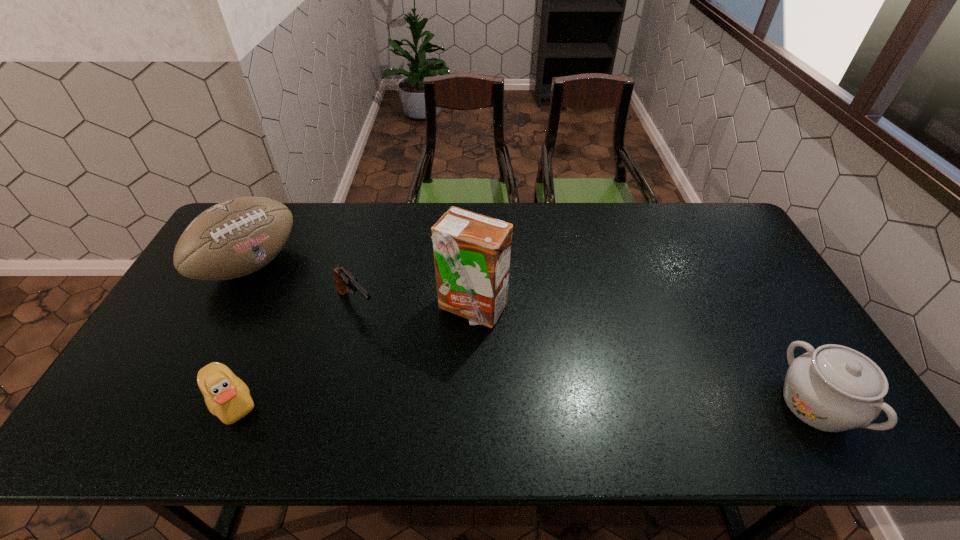
This screenshot has width=960, height=540. I want to click on vacant region located 0.240m along the barrel of the third object from right to left, so click(x=420, y=376).

In order to click on blank space located on the straw side of the tallest object in this screenshot , I will do `click(505, 399)`.

The image size is (960, 540). Find the location of `vacant space situated 0.060m on the straw side of the tallest object`. vacant space situated 0.060m on the straw side of the tallest object is located at coordinates (488, 347).

This screenshot has width=960, height=540. I want to click on free space located on the straw side of the tallest object, so click(x=491, y=356).

What are the coordinates of `vacant area situated 0.190m on the laces of the fourth shortest object` in the screenshot? It's located at (316, 314).

Where is `vacant space located 0.170m on the laces of the fourth shortest object`? The height and width of the screenshot is (540, 960). vacant space located 0.170m on the laces of the fourth shortest object is located at coordinates (311, 310).

Locate an element on the screen. The width and height of the screenshot is (960, 540). free point located on the laces of the fourth shortest object is located at coordinates (302, 304).

Locate an element on the screen. object at the far edge is located at coordinates (237, 237).

This screenshot has height=540, width=960. What are the coordinates of `duck that is at the near edge` in the screenshot? It's located at (227, 397).

Locate an element on the screen. chinaware at the near edge is located at coordinates (834, 388).